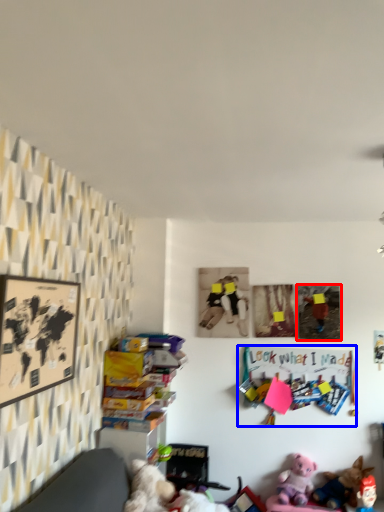
Question: Which object is closer to the camera taking this photo, picture frame (highlighted by a red box) or bulletin board (highlighted by a blue box)?

Choices:
 (A) picture frame
 (B) bulletin board

Answer: (B)